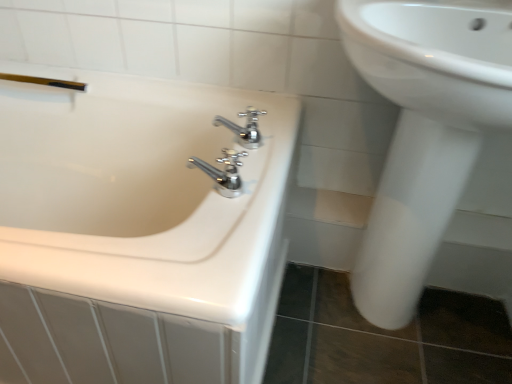
At what (x,y) coordinates should I click in order to perform the action: click on free space behind chrome metallic faucet at center, arranged as the first tap when viewed from the top. Please return your answer as a coordinate pair (x, y). Looking at the image, I should click on click(x=244, y=97).